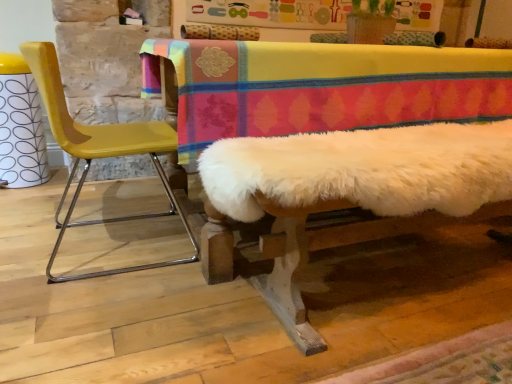
The image size is (512, 384). I want to click on vacant space underneath yellow fabric chair at left (from a real-world perspective), so click(x=115, y=245).